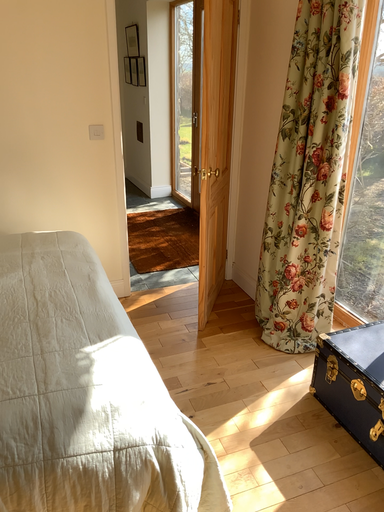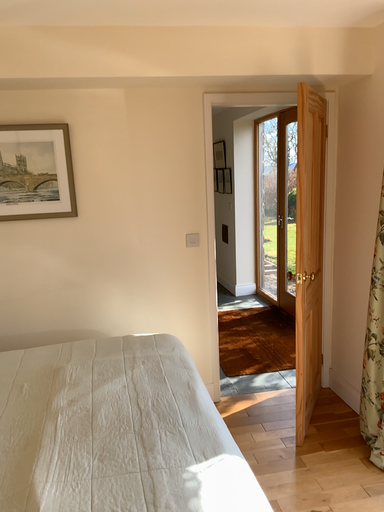
Question: How did the camera likely rotate when shooting the video?

Choices:
 (A) rotated downward
 (B) rotated upward

Answer: (B)